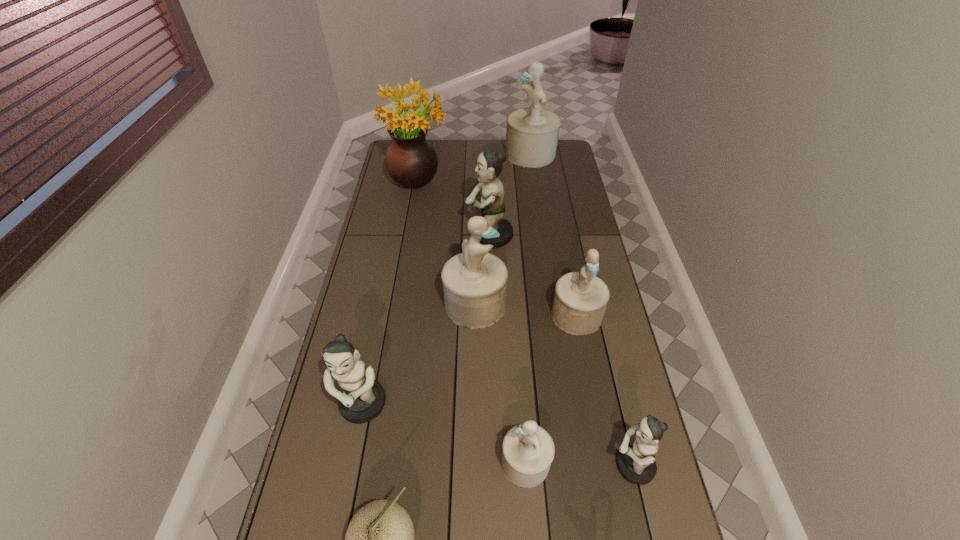
What are the coordinates of `free space between the rightmost green figurine and the biggest green figurine` in the screenshot? It's located at (561, 351).

Image resolution: width=960 pixels, height=540 pixels. What are the coordinates of `empty location between the second biggest white figurine and the leftmost green figurine` in the screenshot? It's located at (419, 355).

You are a GUI agent. You are given a task and a screenshot of the screen. Output one action in this format:
    pyautogui.click(x=<x>, y=<y>)
    Task: Click on the object that stands as the third closest to the nearest green figurine
    
    Given the screenshot: What is the action you would take?
    pyautogui.click(x=474, y=282)

Where is `object that is the second closest to the third smallest white figurine`? This screenshot has height=540, width=960. object that is the second closest to the third smallest white figurine is located at coordinates (489, 163).

Identify which figurine is located as the nearest to the second biggest white figurine. Please provide its 2D coordinates. Your answer should be formatted as a tuple, i.e. [(x, y)], where the tuple contains the x and y coordinates of a point satisfying the conditions above.

[(580, 299)]

You are a GUI agent. You are given a task and a screenshot of the screen. Output one action in this format:
    pyautogui.click(x=<x>, y=<y>)
    Task: Click on the figurine object that ranks as the third closest to the farthest white figurine
    Image resolution: width=960 pixels, height=540 pixels.
    Given the screenshot: What is the action you would take?
    pyautogui.click(x=580, y=299)

Identify which white figurine is the fourth nearest to the cantaloup. Please provide its 2D coordinates. Your answer should be formatted as a tuple, i.e. [(x, y)], where the tuple contains the x and y coordinates of a point satisfying the conditions above.

[(532, 133)]

The width and height of the screenshot is (960, 540). What are the coordinates of `the fourth closest white figurine to the farthest green figurine` in the screenshot? It's located at (527, 451).

Locate an element on the screen. This screenshot has height=540, width=960. green figurine that is the third closest to the third smallest white figurine is located at coordinates (636, 463).

The width and height of the screenshot is (960, 540). I want to click on green figurine object that ranks as the third closest to the flower arrangement, so click(636, 463).